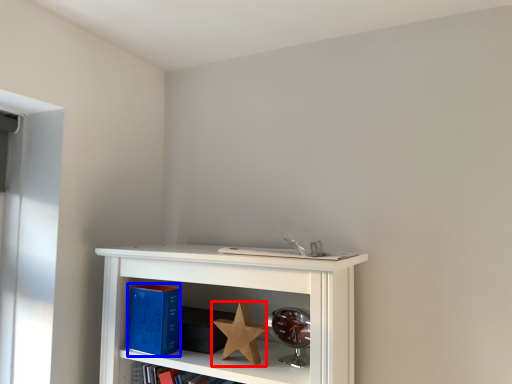
Question: Which object is further to the camera taking this photo, star (highlighted by a red box) or paperback book (highlighted by a blue box)?

Choices:
 (A) star
 (B) paperback book

Answer: (B)